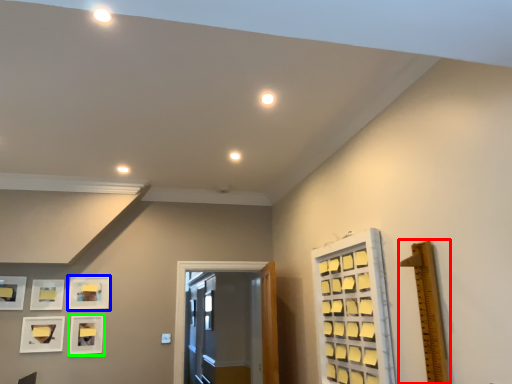
Question: Considering the real-world distances, which object is closest to ruler (highlighted by a red box)? picture frame (highlighted by a blue box) or picture frame (highlighted by a green box).

Choices:
 (A) picture frame
 (B) picture frame

Answer: (A)